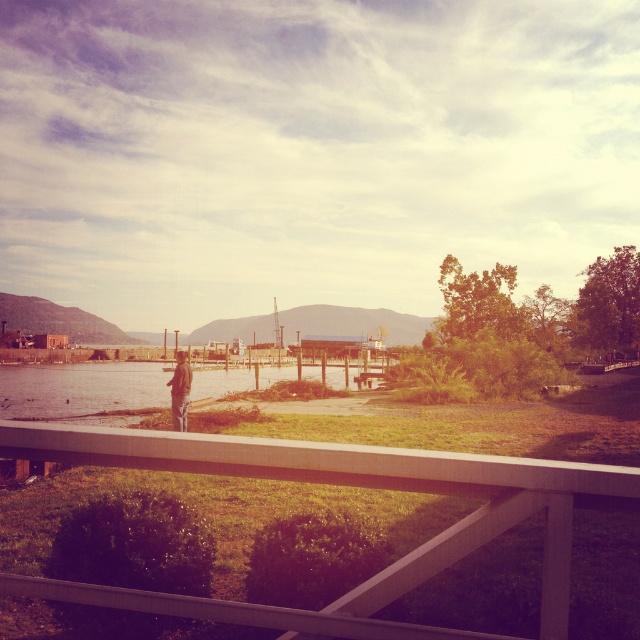
You are standing on the wooden railing in the foreground. You want to look down at the smooth concrete lake at center. Which direction should you look relative to the brown leather jacket at lower center?

To look down at the smooth concrete lake at center, you should look downward from the brown leather jacket at lower center since the lake is positioned below it.

You are a photographer planning to capture a landscape shot of the smooth concrete lake at center and the brown leather jacket at lower center. Based on their heights, which object should appear larger in your photo?

The smooth concrete lake at center should appear larger in the photo because it has a greater height compared to the brown leather jacket at lower center.